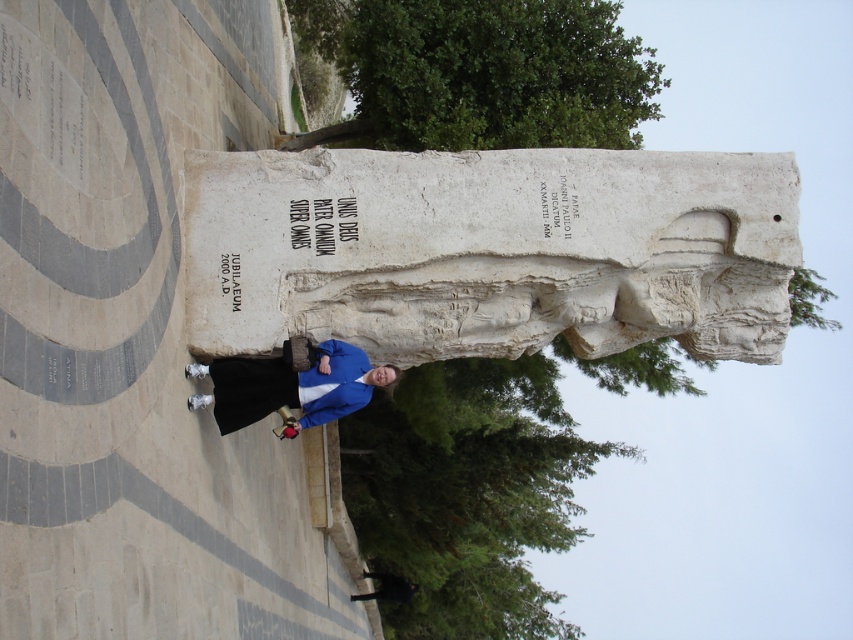
Is white stone sculpture at center bigger than white stone statue at center?

Yes.

Which of these two, white stone sculpture at center or white stone statue at center, stands taller?

With more height is white stone sculpture at center.

Locate an element on the screen. white stone sculpture at center is located at coordinates (136, 339).

This screenshot has width=853, height=640. Identify the location of white stone sculpture at center. (136, 339).

Is white stone sculpture at center taller than black fabric jacket at lower center?

Indeed, white stone sculpture at center has a greater height compared to black fabric jacket at lower center.

Who is shorter, white stone sculpture at center or black fabric jacket at lower center?

Standing shorter between the two is black fabric jacket at lower center.

Is point (67, 422) closer to viewer compared to point (236, 396)?

Yes, it is in front of point (236, 396).

Where is `white stone sculpture at center`? white stone sculpture at center is located at coordinates (136, 339).

Between white stone statue at center and black fabric jacket at lower center, which one has more height?

Standing taller between the two is white stone statue at center.

Does white stone statue at center have a greater height compared to black fabric jacket at lower center?

Yes.

Is point (489, 211) closer to viewer compared to point (192, 397)?

No, (489, 211) is behind (192, 397).

This screenshot has height=640, width=853. Find the location of `white stone statue at center`. white stone statue at center is located at coordinates (490, 252).